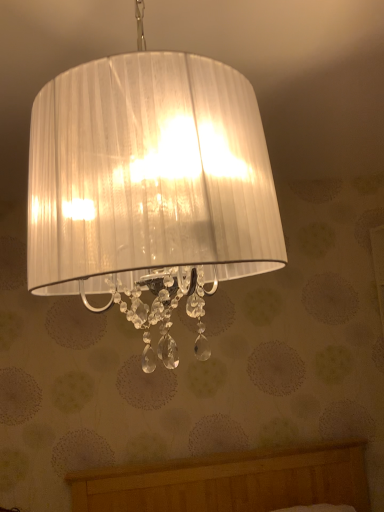
At what (x,y) coordinates should I click in order to perform the action: click on white pleated fabric lampshade at upper center. Please return your answer as a coordinate pair (x, y). The image size is (384, 512). Looking at the image, I should click on (149, 187).

The width and height of the screenshot is (384, 512). What do you see at coordinates (149, 187) in the screenshot?
I see `white pleated fabric lampshade at upper center` at bounding box center [149, 187].

Measure the distance between white pleated fabric lampshade at upper center and camera.

18.44 inches.

Locate an element on the screen. white pleated fabric lampshade at upper center is located at coordinates (149, 187).